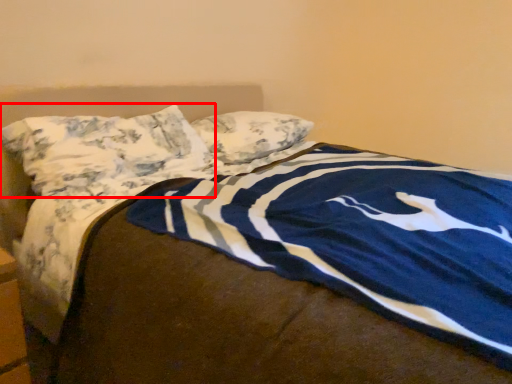
Question: From the image, what is the correct spatial relationship of pillow (annotated by the red box) in relation to pillow?

Choices:
 (A) right
 (B) left

Answer: (B)